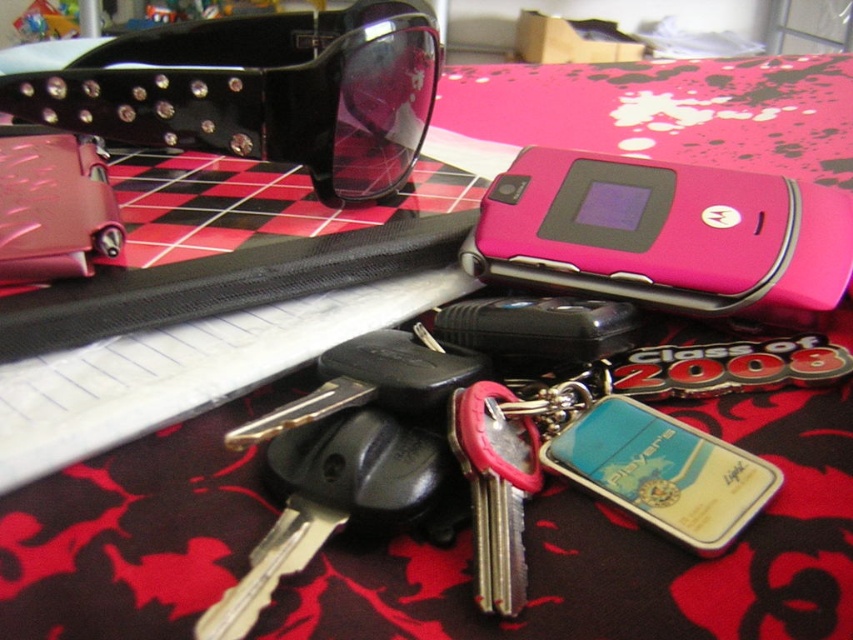
You are organizing items on a table with a red and black patterned fabric background. You need to place a new item exactly where the point at coordinates (260, 92) is located. What object currently occupies that spot?

The point at coordinates (260, 92) is currently occupied by the black shiny sunglasses at upper left.

You are organizing a drawer and need to place the pink plastic motorola phone at center and the metallic silver key at center. The drawer is only 6 inches wide. Can both items fit side by side without overlapping?

The pink plastic motorola phone at center is 7.36 inches from the metallic silver key at center, which means they cannot fit side by side in a 6 inch wide drawer as the total required space exceeds the drawer width.

You are looking at the image and want to know which of the two points, point (474, 228) or point (519, 497), is closer to you. Can you determine this based on their positions?

Point (474, 228) is further to the camera than point (519, 497), so point (519, 497) is closer to you.